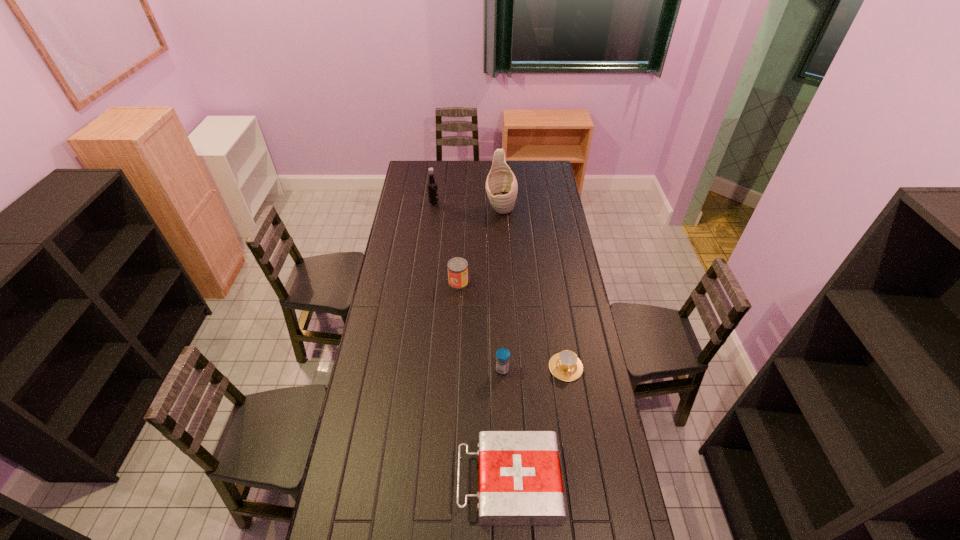
Image resolution: width=960 pixels, height=540 pixels. I want to click on free space at the far left corner of the desktop, so click(x=408, y=177).

The height and width of the screenshot is (540, 960). In order to click on vacant space at the far right corner in this screenshot , I will do `click(546, 179)`.

Identify the location of empty space between the rightmost object and the root beer. Image resolution: width=960 pixels, height=540 pixels. (500, 285).

Image resolution: width=960 pixels, height=540 pixels. I want to click on free space between the can and the cup, so click(x=512, y=325).

Where is `vacant region between the cup and the fourth nearest object`? vacant region between the cup and the fourth nearest object is located at coordinates (512, 325).

Locate an element on the screen. The image size is (960, 540). empty location between the second tallest object and the rightmost object is located at coordinates (500, 285).

Locate an element on the screen. free point between the pitcher and the third farthest object is located at coordinates (480, 246).

Find the location of a particular element. The width and height of the screenshot is (960, 540). free space between the second tallest object and the tallest object is located at coordinates (468, 206).

I want to click on free space between the shortest object and the root beer, so click(500, 285).

Where is `free space between the second tallest object and the first-aid kit`? free space between the second tallest object and the first-aid kit is located at coordinates (471, 342).